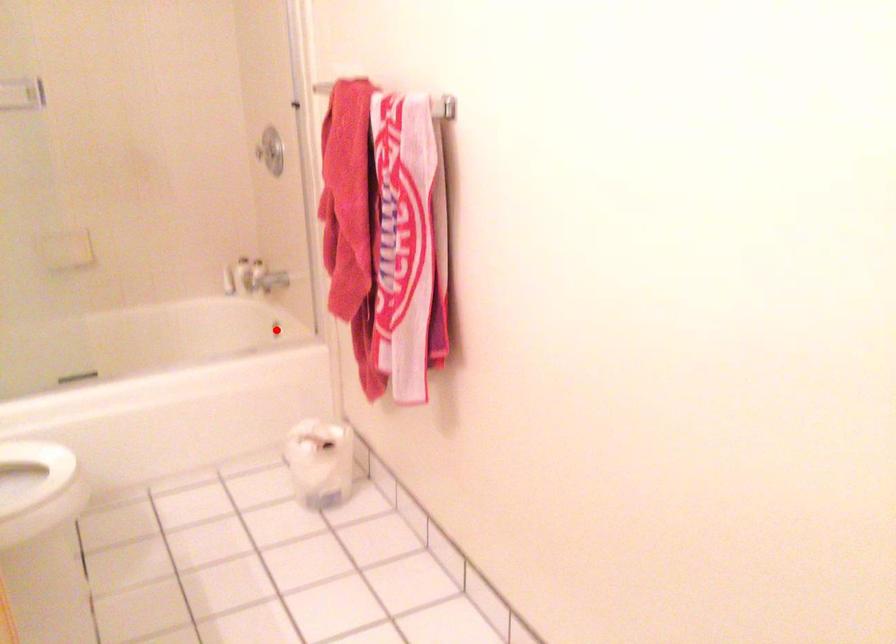
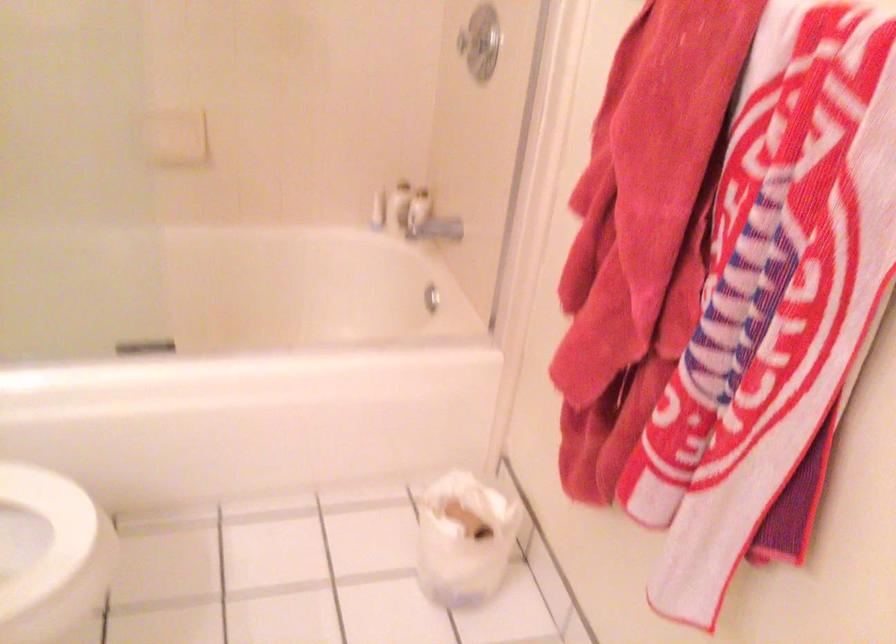
Question: I am providing you with two images of the same scene from different viewpoints. In image1, a red point is highlighted. Considering the same 3D point in image2, which of the following is correct?

Choices:
 (A) It is closer
 (B) It is farther

Answer: (A)